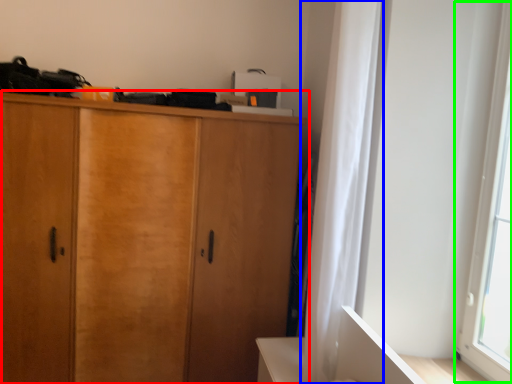
Question: Which object is positioned farthest from cupboard (highlighted by a red box)? Select from curtain (highlighted by a blue box) and window screen (highlighted by a green box).

Choices:
 (A) curtain
 (B) window screen

Answer: (B)